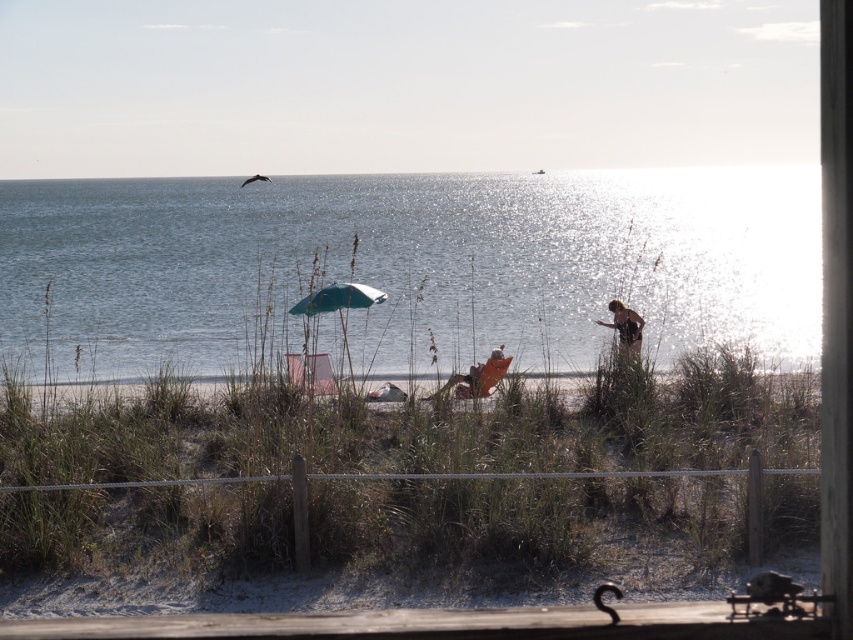
Which of these two, light brown sand at center or brown textured shirt at right, stands taller?

Standing taller between the two is light brown sand at center.

Does light brown sand at center appear on the right side of brown textured shirt at right?

In fact, light brown sand at center is to the left of brown textured shirt at right.

Image resolution: width=853 pixels, height=640 pixels. What do you see at coordinates (531, 531) in the screenshot?
I see `light brown sand at center` at bounding box center [531, 531].

Where is `light brown sand at center`? Image resolution: width=853 pixels, height=640 pixels. light brown sand at center is located at coordinates (531, 531).

Is the position of teal fabric umbrella at center more distant than that of brown textured shirt at right?

No, it is in front of brown textured shirt at right.

Is teal fabric umbrella at center above brown textured shirt at right?

Indeed, teal fabric umbrella at center is positioned over brown textured shirt at right.

You are a GUI agent. You are given a task and a screenshot of the screen. Output one action in this format:
    pyautogui.click(x=<x>, y=<y>)
    Task: Click on the teal fabric umbrella at center
    
    Given the screenshot: What is the action you would take?
    pyautogui.click(x=338, y=298)

Identify the location of teal fabric umbrella at center. The image size is (853, 640). (338, 298).

Does light brown sand at center come in front of glistening blue water at center?

Yes, light brown sand at center is in front of glistening blue water at center.

Between light brown sand at center and glistening blue water at center, which one appears on the right side from the viewer's perspective?

light brown sand at center

Measure the distance between point (630, 568) and camera.

A: A distance of 11.22 meters exists between point (630, 568) and camera.

This screenshot has width=853, height=640. What are the coordinates of `light brown sand at center` in the screenshot? It's located at (531, 531).